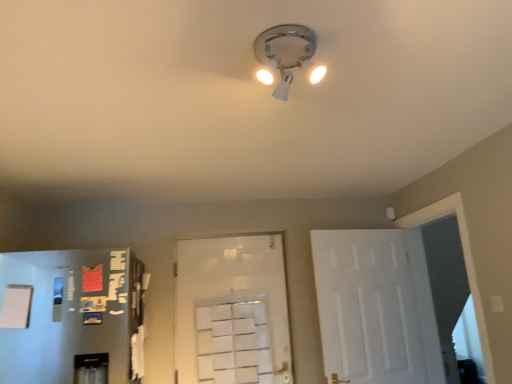
Locate an element on the screen. The width and height of the screenshot is (512, 384). white matte door at right, the 2th door viewed from the left is located at coordinates (366, 307).

What is the approximate width of white matte door at center, the second door positioned from the right?

It is 3.39 inches.

Image resolution: width=512 pixels, height=384 pixels. Describe the element at coordinates (284, 52) in the screenshot. I see `matte white light fixture at center` at that location.

Identify the location of white matte door at right, which ranks as the 1th door in right-to-left order. (366, 307).

From the image's perspective, relative to white matte door at right, which ranks as the 1th door in right-to-left order, is matte white light fixture at center above or below?

Based on their image positions, matte white light fixture at center is located above white matte door at right, which ranks as the 1th door in right-to-left order.

Does matte white light fixture at center have a greater height compared to white matte door at right, which ranks as the 1th door in right-to-left order?

In fact, matte white light fixture at center may be shorter than white matte door at right, which ranks as the 1th door in right-to-left order.

From a real-world perspective, who is located higher, matte white light fixture at center or white matte door at right, the 2th door viewed from the left?

In real-world perspective, matte white light fixture at center is above.

Which object is wider, matte white light fixture at center or white matte door at right, which ranks as the 1th door in right-to-left order?

matte white light fixture at center is wider.

Considering the positions of objects matte white light fixture at center and white matte door at center, acting as the first door starting from the left, in the image provided, who is in front, matte white light fixture at center or white matte door at center, acting as the first door starting from the left,?

matte white light fixture at center is in front.

Could you tell me if matte white light fixture at center is turned towards white matte door at center, acting as the first door starting from the left?

No, matte white light fixture at center is not turned towards white matte door at center, acting as the first door starting from the left.

From the image's perspective, is matte white light fixture at center located beneath white matte door at center, the second door positioned from the right?

Incorrect, from the image's perspective, matte white light fixture at center is higher than white matte door at center, the second door positioned from the right.

In the scene shown: Is matte white light fixture at center next to white matte door at center, the second door positioned from the right, and touching it?

matte white light fixture at center and white matte door at center, the second door positioned from the right, are not in contact.

Are white matte door at center, the second door positioned from the right, and white matte door at right, which ranks as the 1th door in right-to-left order, beside each other?

No.

Locate an element on the screen. The height and width of the screenshot is (384, 512). door in front of the white matte door at center, the second door positioned from the right is located at coordinates (366, 307).

From a real-world perspective, is white matte door at center, the second door positioned from the right, physically above white matte door at right, which ranks as the 1th door in right-to-left order?

Yes.

Does white matte door at center, the second door positioned from the right, lie behind white matte door at right, the 2th door viewed from the left?

That is True.

Does white matte door at right, the 2th door viewed from the left, appear on the left side of white matte door at center, the second door positioned from the right?

No, white matte door at right, the 2th door viewed from the left, is not to the left of white matte door at center, the second door positioned from the right.

How many degrees apart are the facing directions of white matte door at right, which ranks as the 1th door in right-to-left order, and white matte door at center, the second door positioned from the right?

white matte door at right, which ranks as the 1th door in right-to-left order, and white matte door at center, the second door positioned from the right, are facing 14.6 degrees away from each other.

Which is farther from the camera, (x=344, y=371) or (x=244, y=239)?

The point (x=244, y=239) is behind.

Who is shorter, white matte door at right, which ranks as the 1th door in right-to-left order, or white matte door at center, the second door positioned from the right?

white matte door at center, the second door positioned from the right, is shorter.

From a real-world perspective, who is located lower, white matte door at center, the second door positioned from the right, or matte white light fixture at center?

In real-world perspective, white matte door at center, the second door positioned from the right, is lower.

Is point (281, 256) in front of point (280, 38)?

No, it is not.

Are white matte door at center, the second door positioned from the right, and matte white light fixture at center located far from each other?

Yes, white matte door at center, the second door positioned from the right, and matte white light fixture at center are quite far apart.

Does point (326, 282) come behind point (282, 49)?

Yes, point (326, 282) is behind point (282, 49).

Looking at this image, is white matte door at right, which ranks as the 1th door in right-to-left order, closer to camera compared to matte white light fixture at center?

No, white matte door at right, which ranks as the 1th door in right-to-left order, is further to the viewer.

Considering the sizes of objects white matte door at right, which ranks as the 1th door in right-to-left order, and matte white light fixture at center in the image provided, who is wider, white matte door at right, which ranks as the 1th door in right-to-left order, or matte white light fixture at center?

matte white light fixture at center is wider.

From the image's perspective, which one is positioned higher, white matte door at right, the 2th door viewed from the left, or matte white light fixture at center?

matte white light fixture at center is shown above in the image.

From the matte white light fixture at center, count 1st doors backward and point to it. Please provide its 2D coordinates.

[(366, 307)]

Where is `door on the left of matte white light fixture at center`? Image resolution: width=512 pixels, height=384 pixels. door on the left of matte white light fixture at center is located at coordinates (232, 311).

Which object lies further to the anchor point white matte door at right, which ranks as the 1th door in right-to-left order, matte white light fixture at center or white matte door at center, acting as the first door starting from the left?

matte white light fixture at center.

Which object lies further to the anchor point white matte door at right, which ranks as the 1th door in right-to-left order, white matte door at center, acting as the first door starting from the left, or matte white light fixture at center?

The object further to white matte door at right, which ranks as the 1th door in right-to-left order, is matte white light fixture at center.

When comparing their distances from matte white light fixture at center, does white matte door at center, the second door positioned from the right, or white matte door at right, which ranks as the 1th door in right-to-left order, seem further?

white matte door at center, the second door positioned from the right.

Looking at the image, which one is located closer to matte white light fixture at center, white matte door at right, which ranks as the 1th door in right-to-left order, or white matte door at center, the second door positioned from the right?

Based on the image, white matte door at right, which ranks as the 1th door in right-to-left order, appears to be nearer to matte white light fixture at center.

When comparing their distances from white matte door at center, acting as the first door starting from the left, does matte white light fixture at center or white matte door at right, which ranks as the 1th door in right-to-left order, seem further?

Based on the image, matte white light fixture at center appears to be further to white matte door at center, acting as the first door starting from the left.

Looking at this image, considering their positions, is white matte door at right, the 2th door viewed from the left, positioned further to white matte door at center, acting as the first door starting from the left, than matte white light fixture at center?

matte white light fixture at center is positioned further to the anchor white matte door at center, acting as the first door starting from the left.

You are a GUI agent. You are given a task and a screenshot of the screen. Output one action in this format:
    pyautogui.click(x=<x>, y=<y>)
    Task: Click on the door between matte white light fixture at center and white matte door at center, acting as the first door starting from the left, from front to back
    This screenshot has width=512, height=384.
    Given the screenshot: What is the action you would take?
    pyautogui.click(x=366, y=307)